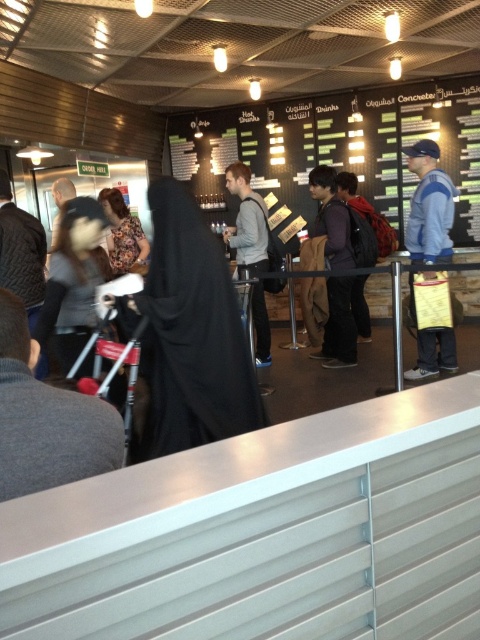
Between point (182, 234) and point (108, 241), which one is positioned in front?

Point (182, 234)

Is the position of black matte abaya at center more distant than that of floral-patterned fabric at center?

No, it is not.

This screenshot has height=640, width=480. I want to click on black matte abaya at center, so click(x=189, y=333).